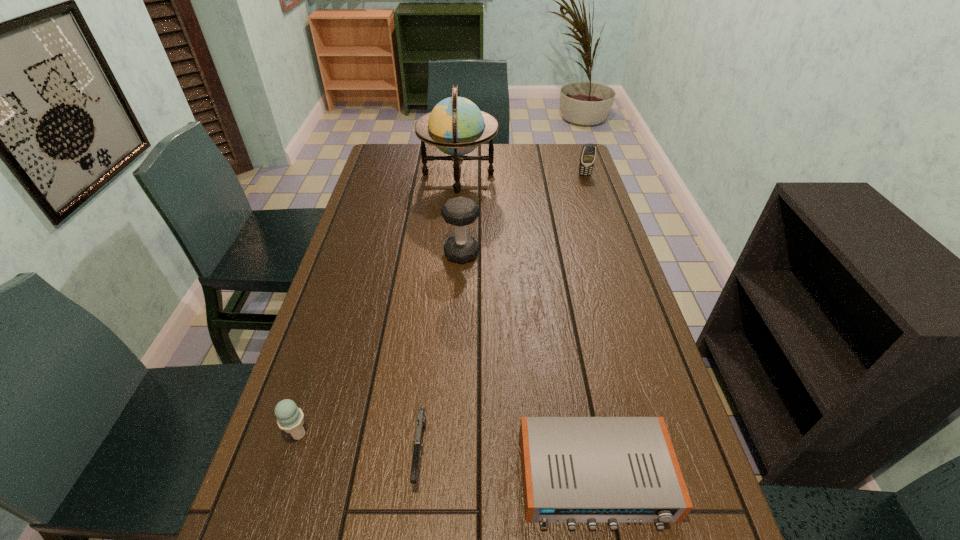
The image size is (960, 540). Identify the location of free spot that satisfies the following two spatial constraints: 1. on the surface of the tallest object; 2. on the back side of the third farthest object. (452, 254).

Where is `free point that satisfies the following two spatial constraints: 1. on the surface of the tallest object; 2. at the muzzle end of the gun`? free point that satisfies the following two spatial constraints: 1. on the surface of the tallest object; 2. at the muzzle end of the gun is located at coordinates (439, 452).

The image size is (960, 540). Identify the location of vacant position in the image that satisfies the following two spatial constraints: 1. on the surface of the fifth shortest object; 2. on the left side of the tallest object. (452, 254).